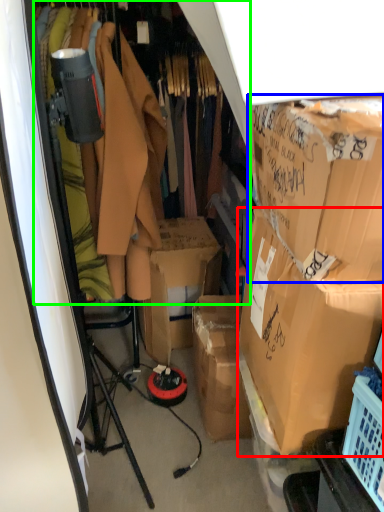
Question: Which object is the closest to the box (highlighted by a red box)? Choose among these: box (highlighted by a blue box) or closet (highlighted by a green box).

Choices:
 (A) box
 (B) closet

Answer: (A)